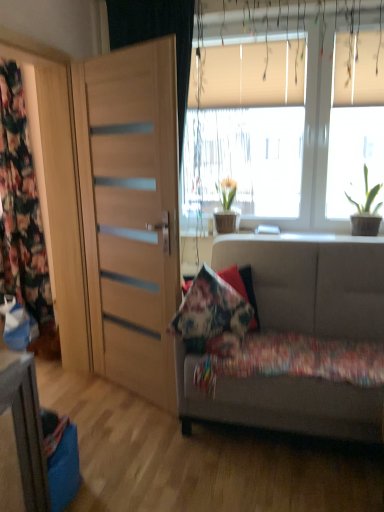
Locate an element on the screen. This screenshot has height=512, width=384. vacant area on top of white matte window at upper center (from a real-world perspective) is located at coordinates (304, 12).